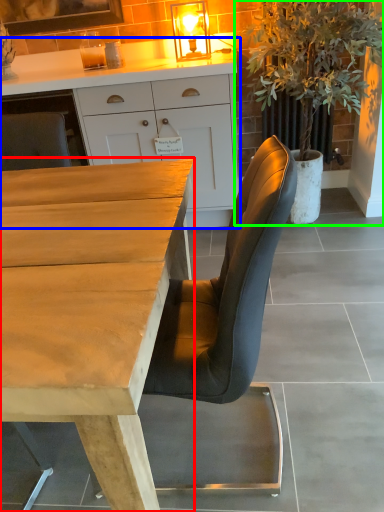
Question: Which object is the closest to the desk (highlighted by a red box)? Choose among these: cabinetry (highlighted by a blue box) or houseplant (highlighted by a green box).

Choices:
 (A) cabinetry
 (B) houseplant

Answer: (A)